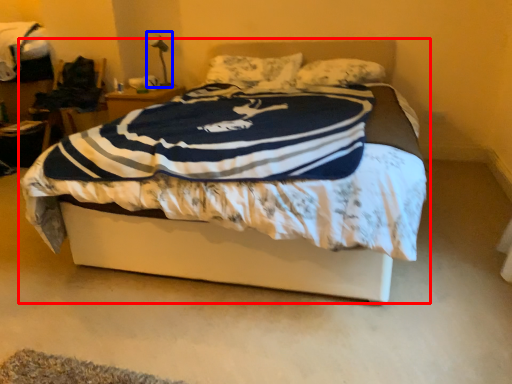
Question: Which of the following is the farthest to the observer, bed (highlighted by a red box) or table lamp (highlighted by a blue box)?

Choices:
 (A) bed
 (B) table lamp

Answer: (B)